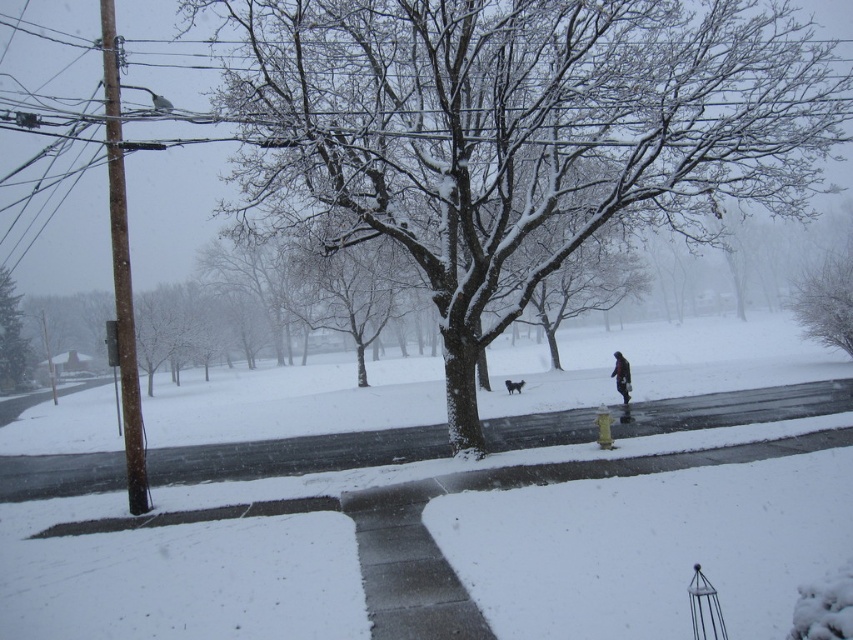
Between white powdery snow at center and dark gray coat at center, which one has more height?

Standing taller between the two is white powdery snow at center.

Is white powdery snow at center to the left of dark gray coat at center from the viewer's perspective?

In fact, white powdery snow at center is to the right of dark gray coat at center.

Image resolution: width=853 pixels, height=640 pixels. Find the location of `white powdery snow at center`. white powdery snow at center is located at coordinates (648, 547).

Who is more distant from viewer, (819, 310) or (10, 348)?

Positioned behind is point (10, 348).

This screenshot has width=853, height=640. Describe the element at coordinates (827, 300) in the screenshot. I see `frosted white tree at upper right` at that location.

Describe the element at coordinates (827, 300) in the screenshot. I see `frosted white tree at upper right` at that location.

At what (x,y) coordinates should I click in order to perform the action: click on frosted white tree at upper right. Please return your answer as a coordinate pair (x, y). Looking at the image, I should click on (827, 300).

This screenshot has height=640, width=853. Describe the element at coordinates (515, 132) in the screenshot. I see `snow-covered tree at center` at that location.

Between snow-covered tree at center and snow-covered tree at left, which one has less height?

snow-covered tree at left

Where is `snow-covered tree at center`? This screenshot has width=853, height=640. snow-covered tree at center is located at coordinates (515, 132).